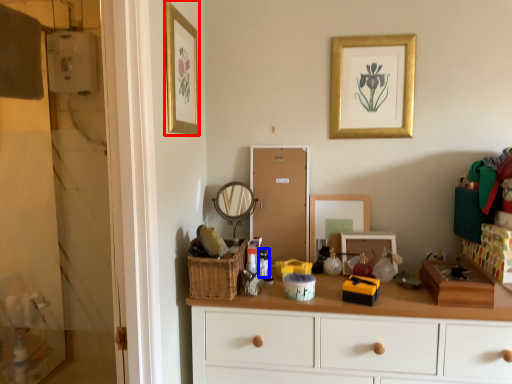
Question: Among these objects, which one is farthest to the camera, picture frame (highlighted by a red box) or toiletry (highlighted by a blue box)?

Choices:
 (A) picture frame
 (B) toiletry

Answer: (B)